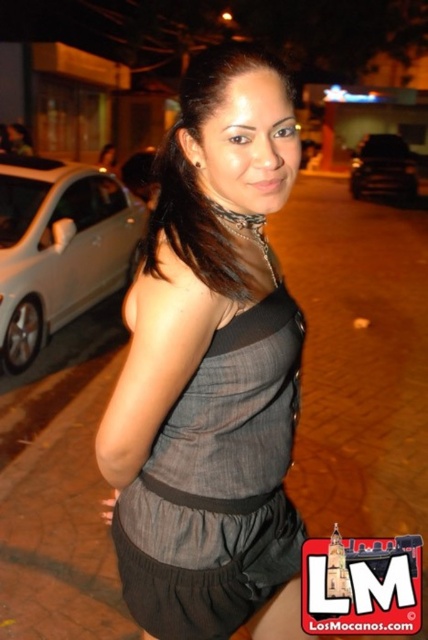
Measure the distance between matte gray dress at center and white metallic car at left.

They are 3.50 meters apart.

Which is more to the left, matte gray dress at center or white metallic car at left?

Positioned to the left is white metallic car at left.

Is point (264, 317) behind point (65, 216)?

No, (264, 317) is in front of (65, 216).

Locate an element on the screen. This screenshot has height=640, width=428. matte gray dress at center is located at coordinates (211, 371).

Can you confirm if white metallic car at left is thinner than black glossy car at right?

Yes.

Is point (88, 257) positioned in front of point (368, 163)?

Yes, it is in front of point (368, 163).

Find the location of a particular element. This screenshot has height=640, width=428. white metallic car at left is located at coordinates (59, 248).

Is point (294, 454) farther from camera compared to point (359, 182)?

No.

Between point (419, 426) and point (382, 188), which one is positioned in front?

Positioned in front is point (419, 426).

Identify the location of brown brick pavement at center. The width and height of the screenshot is (428, 640). (359, 362).